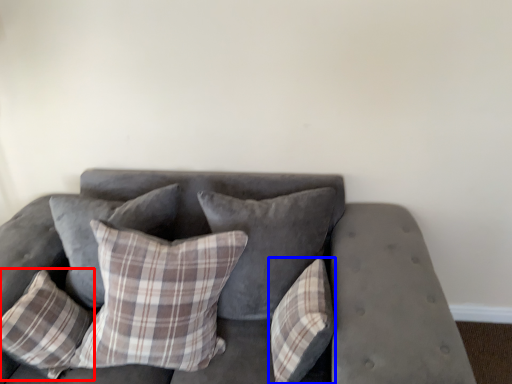
Question: Which object is closer to the camera taking this photo, pillow (highlighted by a red box) or pillow (highlighted by a blue box)?

Choices:
 (A) pillow
 (B) pillow

Answer: (B)